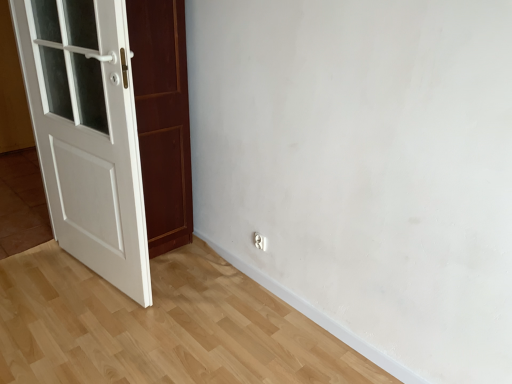
The width and height of the screenshot is (512, 384). Find the location of `vacant space to the right of white wooden door at left`. vacant space to the right of white wooden door at left is located at coordinates (201, 267).